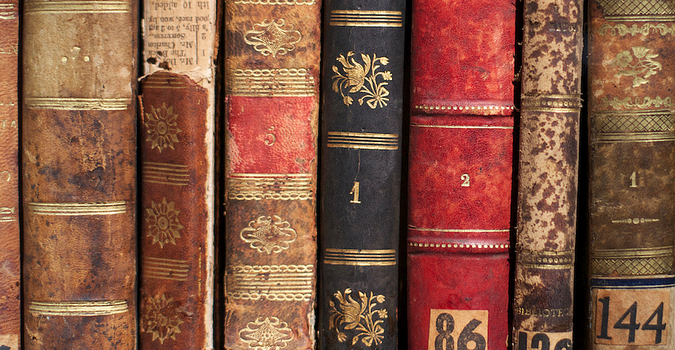
Image resolution: width=675 pixels, height=350 pixels. I want to click on books, so click(5, 170), click(40, 173), click(162, 156), click(265, 140), click(375, 122), click(437, 130), click(562, 118), click(613, 121).